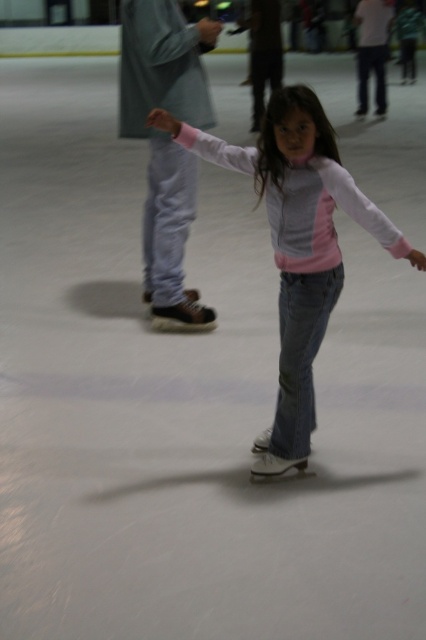
Does pink matte jacket at center have a lesser height compared to matte brown skate at left?

Yes, pink matte jacket at center is shorter than matte brown skate at left.

Find the location of a particular element. This screenshot has width=426, height=640. pink matte jacket at center is located at coordinates (296, 244).